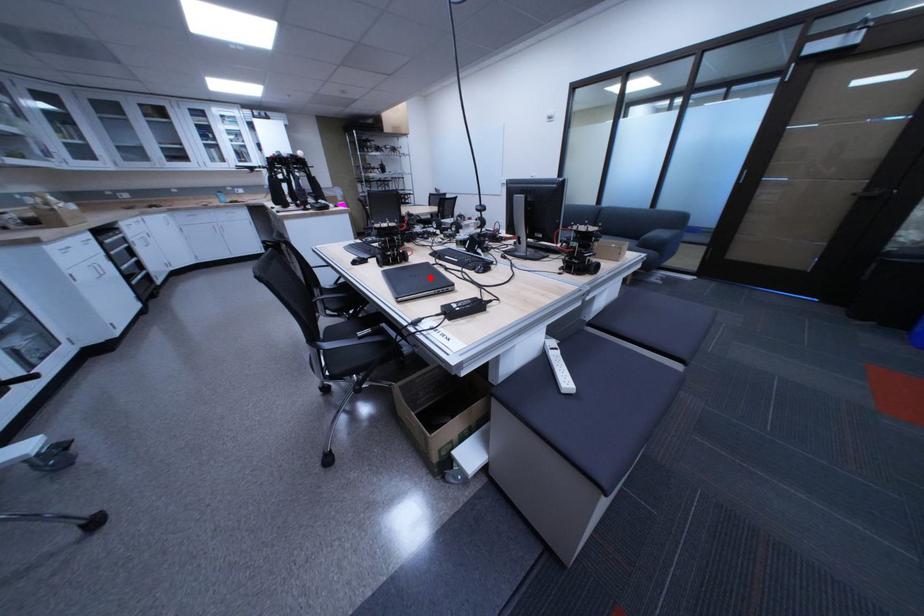
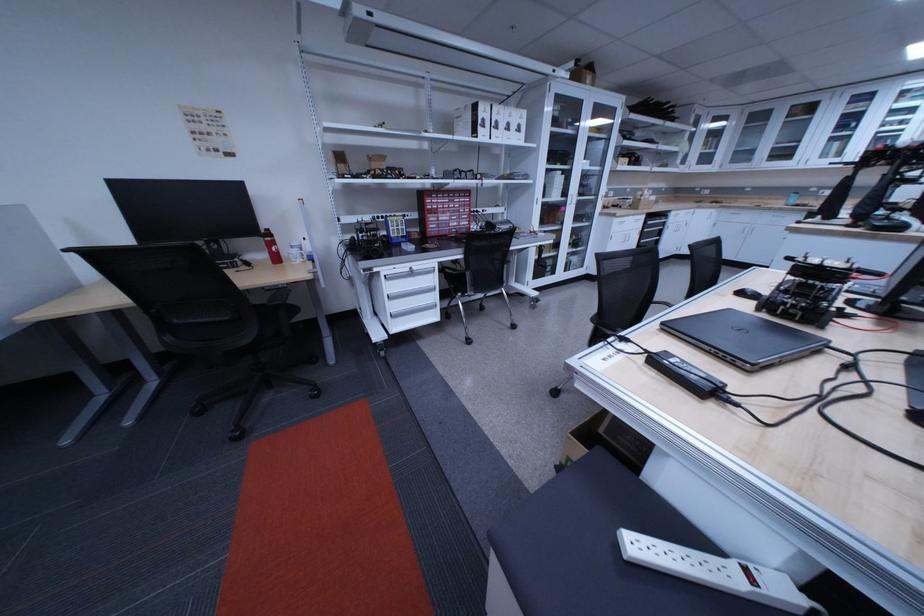
Where in the second image is the point corresponding to the highlighted location from the first image?

(755, 331)